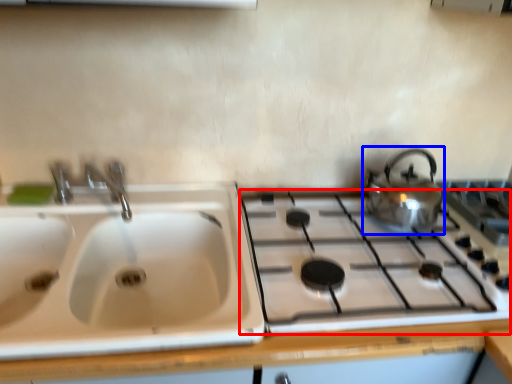
Question: Which point is closer to the camera, gas stove (highlighted by a red box) or kettle (highlighted by a blue box)?

Choices:
 (A) gas stove
 (B) kettle

Answer: (A)